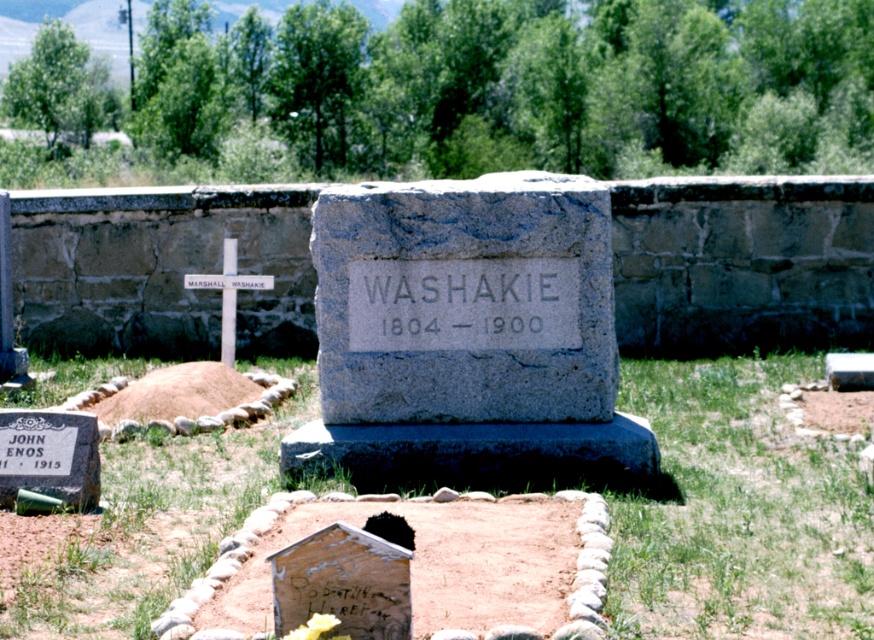
You are a visitor at the cemetery and want to place a bouquet of flowers between the gray stone monument at center and the white wood cross at center. Which object should you place the flowers closer to if you want them to be equidistant from both?

The flowers should be placed closer to the white wood cross at center because the gray stone monument at center is bigger, so the midpoint between them would require the flowers to be nearer to the smaller object to maintain equal distance.

Consider the image. Based on the coordinates provided, which object in the scene is located at point (467, 337)?

The gray stone monument at center is located at point (467, 337).

You are standing at the entrance of the cemetery and want to locate the gray stone monument at center. According to the coordinates provided, where should you look to find it?

The gray stone monument at center is located at coordinates point (467,337).